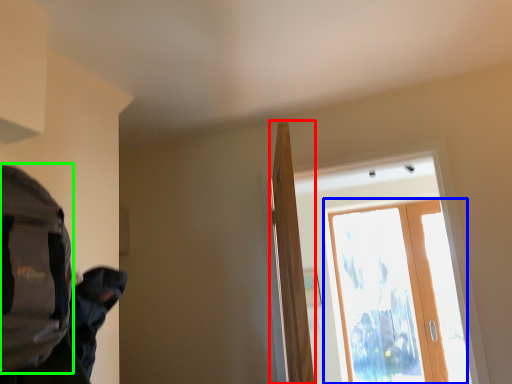
Question: Estimate the real-world distances between objects in this image. Which object is farther from door (highlighted by a red box), screen door (highlighted by a blue box) or backpack (highlighted by a green box)?

Choices:
 (A) screen door
 (B) backpack

Answer: (A)